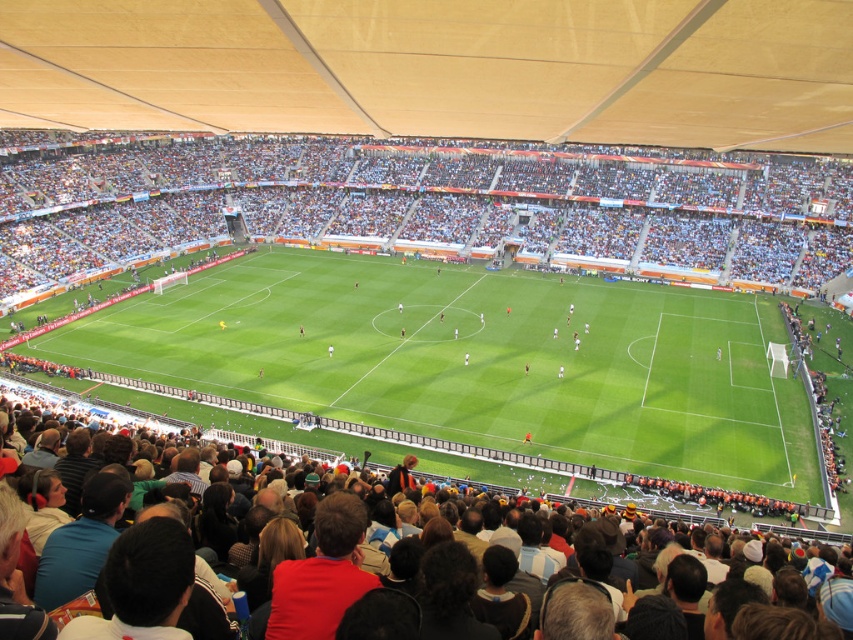
Question: Which object is positioned closest to the green grass football field at center?

Choices:
 (A) dark brown leather jacket at lower center
 (B) matte beige canopy at upper center

Answer: (A)

Question: Among these points, which one is farthest from the camera?

Choices:
 (A) (207, 52)
 (B) (550, 372)

Answer: (B)

Question: Does matte beige canopy at upper center have a lesser width compared to dark brown leather jacket at lower center?

Choices:
 (A) yes
 (B) no

Answer: (A)

Question: Is green grass football field at center positioned behind dark brown leather jacket at lower center?

Choices:
 (A) yes
 (B) no

Answer: (A)

Question: Estimate the real-world distances between objects in this image. Which object is closer to the matte beige canopy at upper center?

Choices:
 (A) green grass football field at center
 (B) dark brown leather jacket at lower center

Answer: (B)

Question: Observing the image, what is the correct spatial positioning of green grass football field at center in reference to matte beige canopy at upper center?

Choices:
 (A) right
 (B) left

Answer: (B)